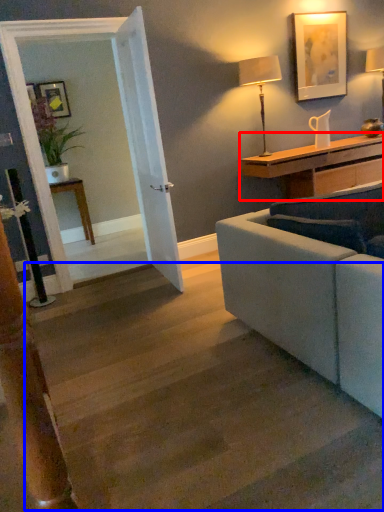
Question: Among these objects, which one is farthest to the camera, desk (highlighted by a red box) or stairwell (highlighted by a blue box)?

Choices:
 (A) desk
 (B) stairwell

Answer: (A)